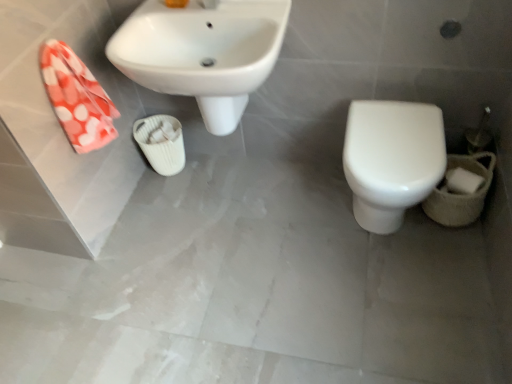
Question: From the image's perspective, relative to white glossy toilet at lower right, is white ribbed cup at center above or below?

Choices:
 (A) above
 (B) below

Answer: (A)

Question: In the image, is white ribbed cup at center positioned in front of or behind white glossy toilet at lower right?

Choices:
 (A) behind
 (B) front

Answer: (A)

Question: Which is farther from the white glossy toilet at lower right?

Choices:
 (A) white matte toilet paper at lower right
 (B) white ribbed cup at center
 (C) white glossy sink at upper left
 (D) orange polka dot fabric at left

Answer: (D)

Question: Which object is positioned farthest from the white glossy toilet at lower right?

Choices:
 (A) white matte toilet paper at lower right
 (B) orange polka dot fabric at left
 (C) white glossy sink at upper left
 (D) white ribbed cup at center

Answer: (B)